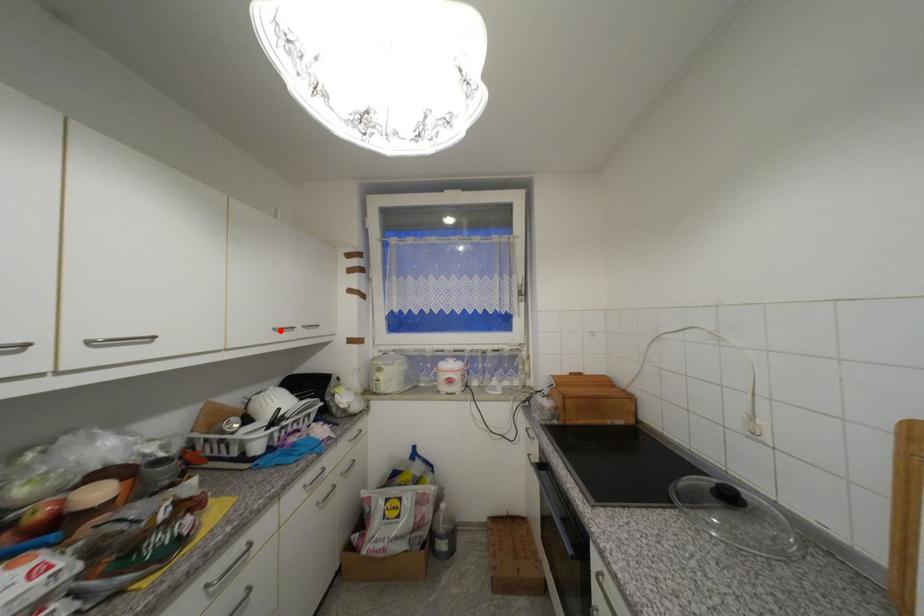
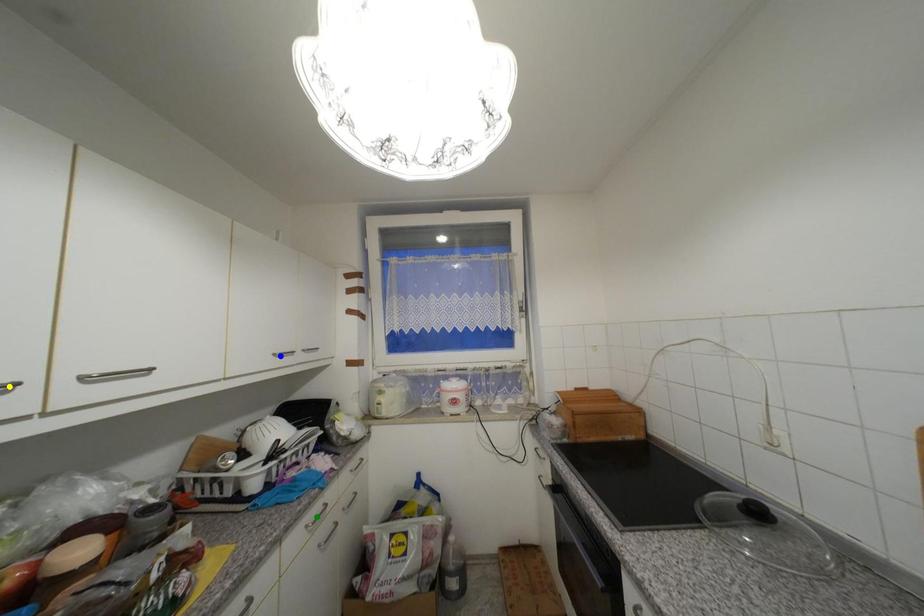
Question: I am providing you with two images of the same scene from different viewpoints. A red point is marked on the first image. You are given multiple points on the second image. In image 2, which mark is for the same physical point as the one in image 1?

Choices:
 (A) blue point
 (B) green point
 (C) yellow point

Answer: (A)